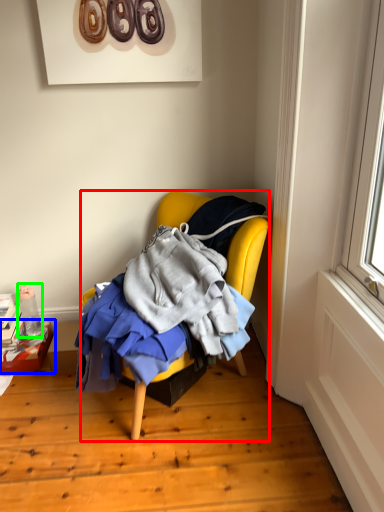
Question: Which object is the closest to the chair (highlighted by a red box)? Choose among these: box (highlighted by a blue box) or bottle (highlighted by a green box).

Choices:
 (A) box
 (B) bottle

Answer: (B)